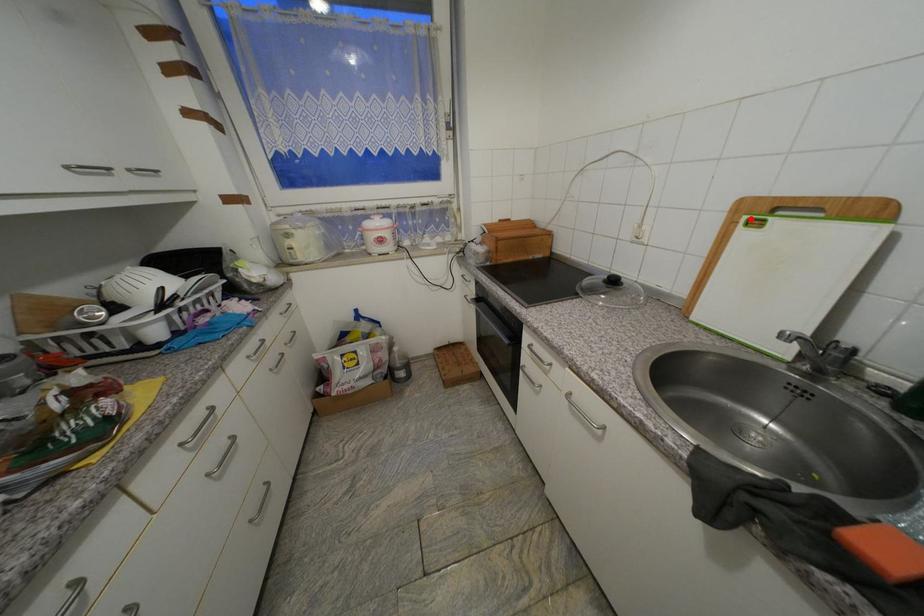
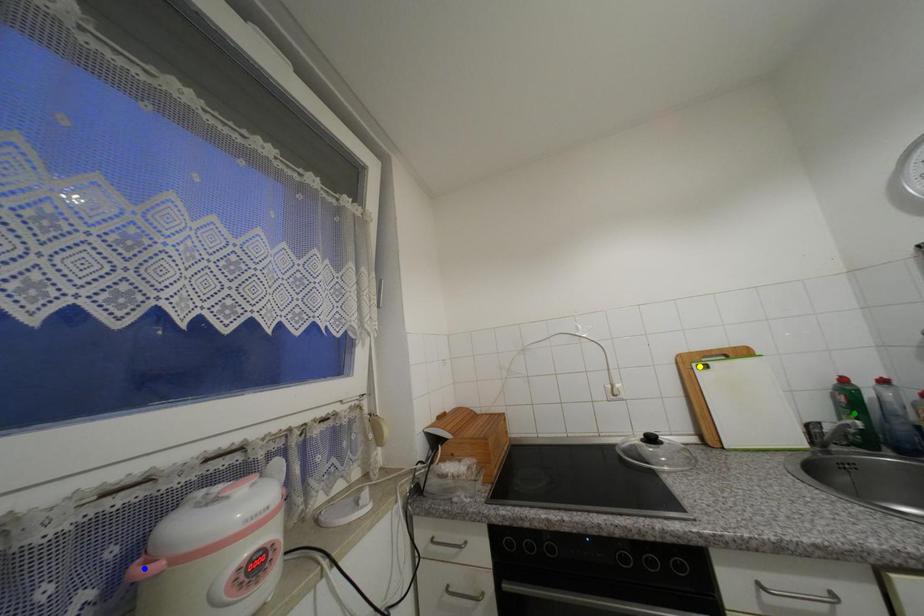
Question: I am providing you with two images of the same scene from different viewpoints. A red point is marked on the first image. You are given multiple points on the second image. Which point in image 2 represents the same 3d spot as the red point in image 1?

Choices:
 (A) blue point
 (B) green point
 (C) yellow point

Answer: (C)